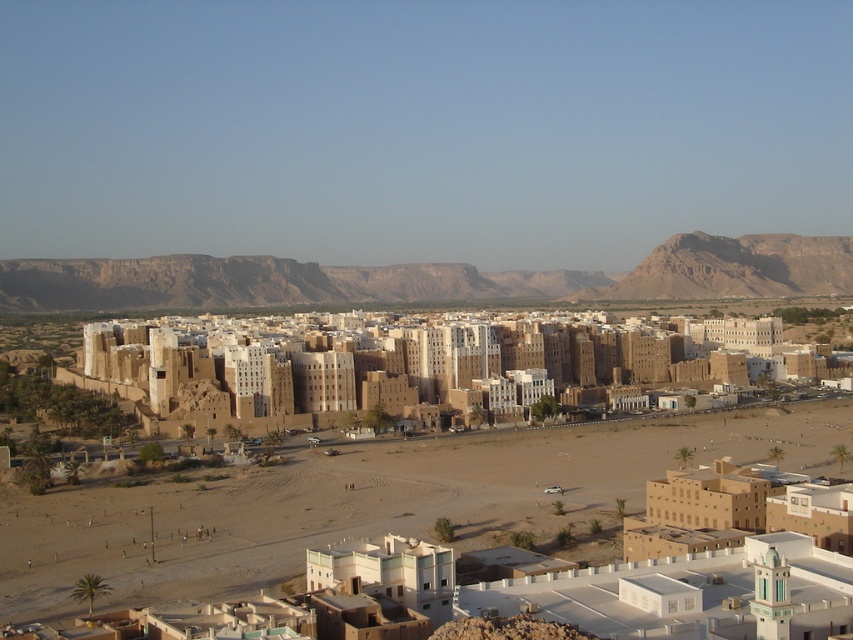
Is brown sand at lower center wider than brown rocky mountain at upper right?

Correct, the width of brown sand at lower center exceeds that of brown rocky mountain at upper right.

Which is above, brown sand at lower center or brown rocky mountain at upper right?

brown rocky mountain at upper right is above.

Find the location of a particular element. This screenshot has height=640, width=853. brown sand at lower center is located at coordinates (370, 502).

Is brown sand at lower center above brown rocky mountain at center?

No.

Does point (457, 545) lie in front of point (267, 296)?

Yes, it is in front of point (267, 296).

This screenshot has height=640, width=853. What are the coordinates of `brown sand at lower center` in the screenshot? It's located at (370, 502).

Can you confirm if brown mud-brick buildings at center is smaller than brown rocky mountain at upper right?

No, brown mud-brick buildings at center is not smaller than brown rocky mountain at upper right.

Is point (585, 378) positioned behind point (758, 285)?

No, (585, 378) is in front of (758, 285).

This screenshot has width=853, height=640. I want to click on brown mud-brick buildings at center, so click(401, 365).